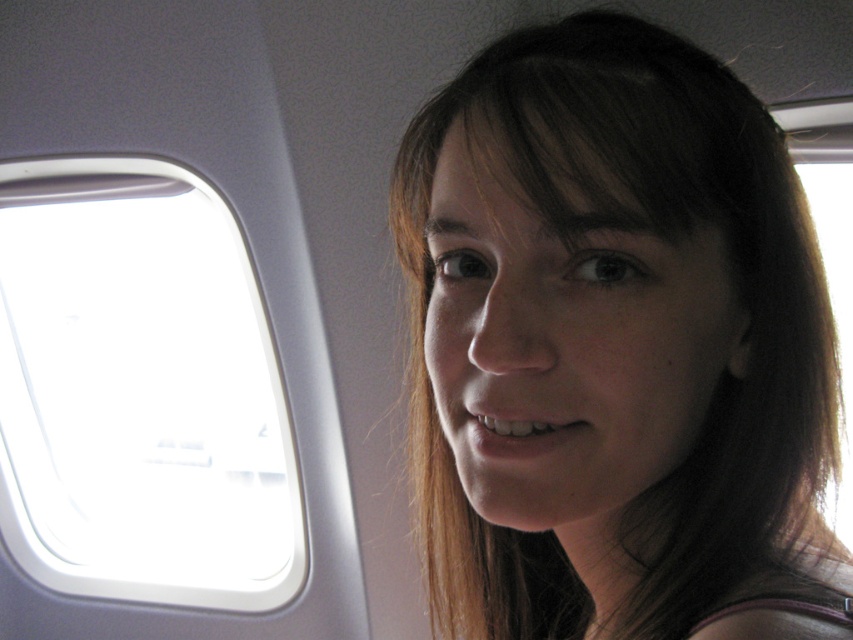
You are a flight attendant checking the cabin. You notice the brown hair at upper center and the transparent glass airplane window at upper left. Which object is nearer to you as you walk down the aisle?

The brown hair at upper center is closer to the viewer than the transparent glass airplane window at upper left, so the brown hair at upper center is nearer to you.

You are a flight attendant checking the cabin. You notice the brown hair at upper center and the transparent glass airplane window at upper left. Which object has a smaller width?

The brown hair at upper center is thinner than the transparent glass airplane window at upper left, so the brown hair at upper center has a smaller width.